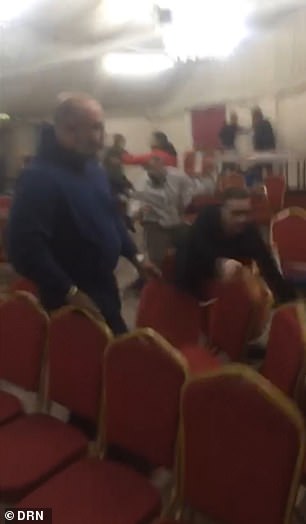
You are a GUI agent. You are given a task and a screenshot of the screen. Output one action in this format:
    pyautogui.click(x=<x>, y=<y>)
    Task: Click on the chair
    This screenshot has width=306, height=524.
    Given the screenshot: What is the action you would take?
    pyautogui.click(x=223, y=473)